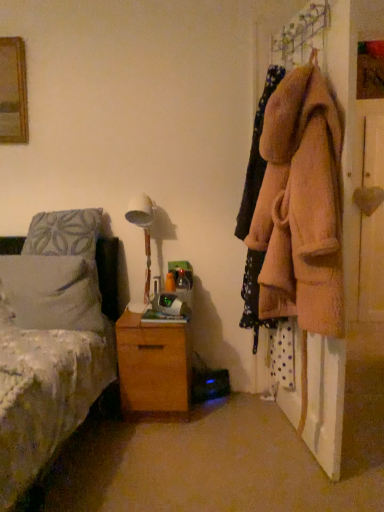
Image resolution: width=384 pixels, height=512 pixels. Find the location of `wooden chest of drawers at lower center`. wooden chest of drawers at lower center is located at coordinates coord(154,365).

This screenshot has height=512, width=384. Find the location of `white soft pillow at left`. white soft pillow at left is located at coordinates (52, 292).

This screenshot has height=512, width=384. Identify the location of wooden heart at right. tap(371, 266).

Find the location of `clothing lying in front of the wooden heart at right`. clothing lying in front of the wooden heart at right is located at coordinates (256, 156).

From a real-world perspective, which object stands above the other?

fuzzy beige coat at right is physically above.

Is fuzzy beige coat at right inside or outside of wooden heart at right?

The correct answer is: outside.

From a real-world perspective, is white fabric lampshade at center physically located above or below white soft pillow at left?

white fabric lampshade at center is situated higher than white soft pillow at left in the real world.

Considering the sizes of white fabric lampshade at center and white soft pillow at left in the image, is white fabric lampshade at center bigger or smaller than white soft pillow at left?

white fabric lampshade at center is smaller than white soft pillow at left.

At what (x,y) coordinates should I click in order to perform the action: click on pillow below the white fabric lampshade at center (from the image's perspective). Please return your answer as a coordinate pair (x, y). Looking at the image, I should click on (52, 292).

Is white fabric lampshade at center wider than white soft pillow at left?

Yes, white fabric lampshade at center is wider than white soft pillow at left.

Looking at this image, could you tell me if wooden heart at right is turned towards wooden chest of drawers at lower center?

No, wooden heart at right is not turned towards wooden chest of drawers at lower center.

Considering the sizes of wooden heart at right and wooden chest of drawers at lower center in the image, is wooden heart at right taller or shorter than wooden chest of drawers at lower center?

In the image, wooden heart at right appears to be taller than wooden chest of drawers at lower center.

Which object is closer to the camera taking this photo, wooden heart at right or wooden chest of drawers at lower center?

Positioned in front is wooden chest of drawers at lower center.

From the image's perspective, which one is positioned lower, wooden heart at right or wooden chest of drawers at lower center?

wooden chest of drawers at lower center.

Does fuzzy pink coat at right have a larger size compared to fuzzy beige coat at right?

Correct, fuzzy pink coat at right is larger in size than fuzzy beige coat at right.

Measure the distance from fuzzy pink coat at right to fuzzy beige coat at right.

12.58 inches.

The height and width of the screenshot is (512, 384). Identify the location of clothing that appears behind the fuzzy pink coat at right. (256, 156).

Is fuzzy pink coat at right at the right side of fuzzy beige coat at right?

Indeed, fuzzy pink coat at right is positioned on the right side of fuzzy beige coat at right.

How far apart are wooden chest of drawers at lower center and fuzzy beige coat at right?

They are 24.02 inches apart.

Which object is more forward, wooden chest of drawers at lower center or fuzzy beige coat at right?

fuzzy beige coat at right is closer to the camera.

From a real-world perspective, which is physically above, wooden chest of drawers at lower center or fuzzy beige coat at right?

fuzzy beige coat at right, from a real-world perspective.

Is wooden chest of drawers at lower center looking in the opposite direction of fuzzy beige coat at right?

wooden chest of drawers at lower center does not have its back to fuzzy beige coat at right.

Is fuzzy beige coat at right turned away from wooden chest of drawers at lower center?

No, fuzzy beige coat at right is not facing the opposite direction of wooden chest of drawers at lower center.

From a real-world perspective, is fuzzy beige coat at right above or below wooden chest of drawers at lower center?

fuzzy beige coat at right is situated higher than wooden chest of drawers at lower center in the real world.

Is fuzzy beige coat at right smaller than wooden chest of drawers at lower center?

No, fuzzy beige coat at right is not smaller than wooden chest of drawers at lower center.

Is fuzzy beige coat at right inside the boundaries of wooden chest of drawers at lower center, or outside?

fuzzy beige coat at right is spatially situated outside wooden chest of drawers at lower center.

From the image's perspective, is white fabric lampshade at center on top of wooden heart at right?

No, from the image's perspective, white fabric lampshade at center is not on top of wooden heart at right.

Is white fabric lampshade at center with wooden heart at right?

No.

Between white fabric lampshade at center and wooden heart at right, which one has more height?

With more height is wooden heart at right.

Can you confirm if white fabric lampshade at center is positioned to the left of wooden heart at right?

Correct, you'll find white fabric lampshade at center to the left of wooden heart at right.

Locate an element on the screen. The width and height of the screenshot is (384, 512). door on the right of fuzzy beige coat at right is located at coordinates (371, 266).

Where is `pillow on the left of white fabric lampshade at center`? The height and width of the screenshot is (512, 384). pillow on the left of white fabric lampshade at center is located at coordinates (52, 292).

When comparing their distances from fuzzy beige coat at right, does fuzzy pink coat at right or white fabric lampshade at center seem further?

white fabric lampshade at center is further to fuzzy beige coat at right.

Looking at the image, which one is located further to fuzzy pink coat at right, white soft pillow at left or white fabric lampshade at center?

white soft pillow at left lies further to fuzzy pink coat at right than the other object.

Based on their spatial positions, is white soft pillow at left or fuzzy pink coat at right further from wooden heart at right?

Among the two, white soft pillow at left is located further to wooden heart at right.

Looking at the image, which one is located further to white fabric lampshade at center, wooden chest of drawers at lower center or fuzzy beige coat at right?

Among the two, fuzzy beige coat at right is located further to white fabric lampshade at center.

Which object lies nearer to the anchor point fuzzy pink coat at right, white fabric lampshade at center or wooden chest of drawers at lower center?

wooden chest of drawers at lower center is closer to fuzzy pink coat at right.

Based on their spatial positions, is fuzzy beige coat at right or fuzzy pink coat at right further from white soft pillow at left?

Among the two, fuzzy pink coat at right is located further to white soft pillow at left.

When comparing their distances from white fabric lampshade at center, does fuzzy beige coat at right or fuzzy pink coat at right seem further?

fuzzy pink coat at right lies further to white fabric lampshade at center than the other object.

Based on their spatial positions, is wooden heart at right or fuzzy beige coat at right closer to white fabric lampshade at center?

Among the two, fuzzy beige coat at right is located nearer to white fabric lampshade at center.

You are a GUI agent. You are given a task and a screenshot of the screen. Output one action in this format:
    pyautogui.click(x=<x>, y=<y>)
    Task: Click on the chest of drawers located between fuzzy pink coat at right and wooden heart at right in the depth direction
    The image size is (384, 512).
    Given the screenshot: What is the action you would take?
    pyautogui.click(x=154, y=365)

In order to click on chest of drawers between white soft pillow at left and fuzzy beige coat at right from left to right in this screenshot , I will do `click(154, 365)`.

Where is `pillow between white fabric lampshade at center and wooden chest of drawers at lower center vertically`? This screenshot has width=384, height=512. pillow between white fabric lampshade at center and wooden chest of drawers at lower center vertically is located at coordinates (52, 292).

I want to click on the chest of drawers located between white soft pillow at left and wooden heart at right in the left-right direction, so click(154, 365).